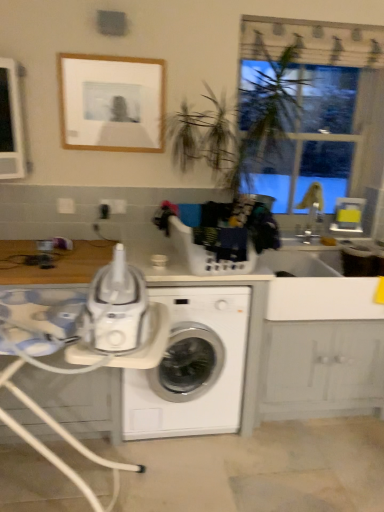
Question: Can you confirm if white plastic table at lower left is thinner than white plastic tray at center?

Choices:
 (A) yes
 (B) no

Answer: (A)

Question: Does white plastic table at lower left have a smaller size compared to white plastic tray at center?

Choices:
 (A) yes
 (B) no

Answer: (A)

Question: Considering the relative sizes of white plastic table at lower left and white plastic tray at center in the image provided, is white plastic table at lower left shorter than white plastic tray at center?

Choices:
 (A) no
 (B) yes

Answer: (A)

Question: Is white plastic tray at center at the back of white plastic table at lower left?

Choices:
 (A) yes
 (B) no

Answer: (A)

Question: Is white plastic table at lower left completely or partially outside of white plastic tray at center?

Choices:
 (A) yes
 (B) no

Answer: (A)

Question: Is white plastic table at lower left aimed at white plastic tray at center?

Choices:
 (A) no
 (B) yes

Answer: (A)

Question: Considering the relative sizes of white glossy washing machine at center and transparent plastic window screen at upper right in the image provided, is white glossy washing machine at center smaller than transparent plastic window screen at upper right?

Choices:
 (A) no
 (B) yes

Answer: (A)

Question: Does white glossy washing machine at center come behind transparent plastic window screen at upper right?

Choices:
 (A) no
 (B) yes

Answer: (A)

Question: Can you confirm if white glossy washing machine at center is wider than transparent plastic window screen at upper right?

Choices:
 (A) yes
 (B) no

Answer: (A)

Question: Does white glossy washing machine at center have a lesser width compared to transparent plastic window screen at upper right?

Choices:
 (A) no
 (B) yes

Answer: (A)

Question: Is white glossy washing machine at center oriented towards transparent plastic window screen at upper right?

Choices:
 (A) yes
 (B) no

Answer: (B)

Question: Is white glossy washing machine at center far away from transparent plastic window screen at upper right?

Choices:
 (A) no
 (B) yes

Answer: (B)

Question: Is white plastic tray at center taller than white glossy washing machine at center?

Choices:
 (A) yes
 (B) no

Answer: (A)